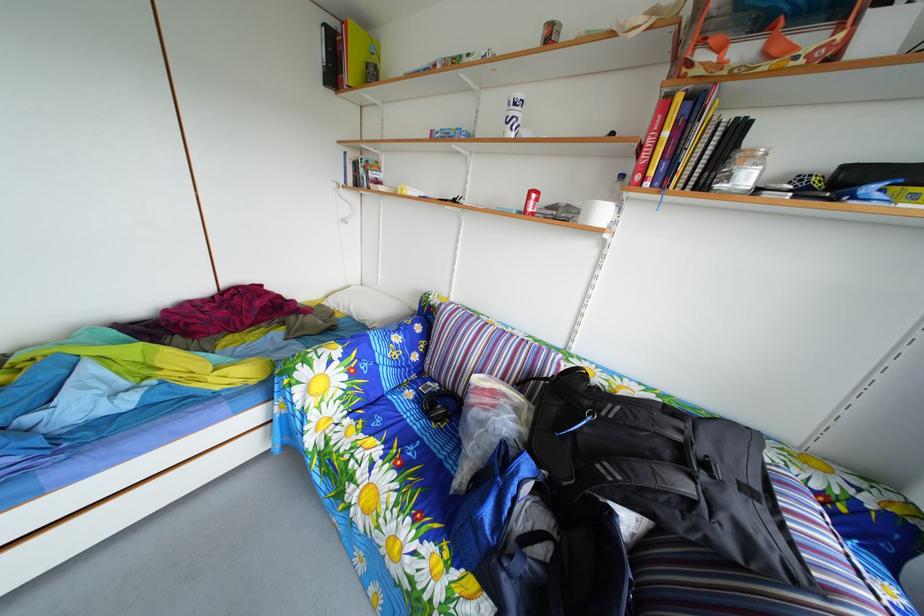
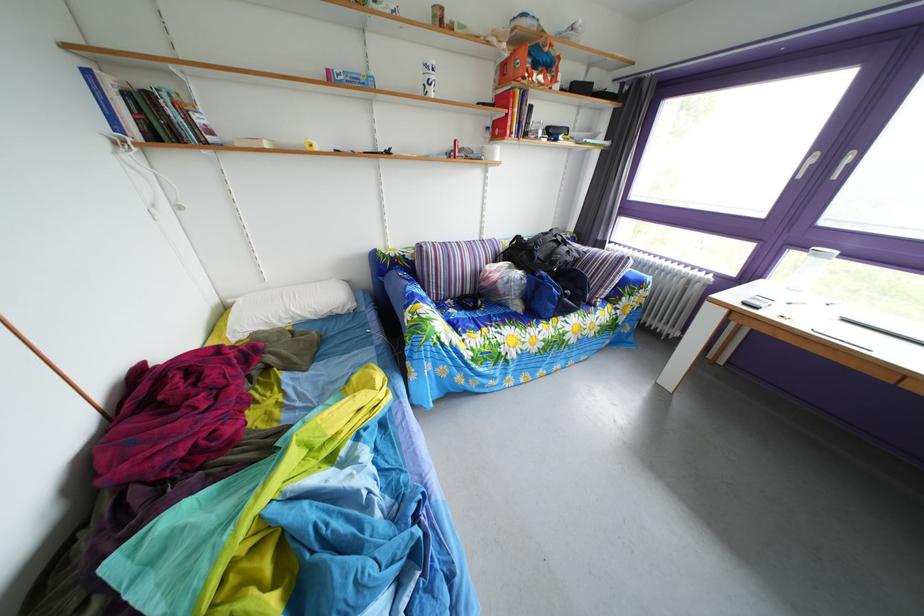
Find the pixel in the second image that matches [407,336] in the first image.

(417, 290)